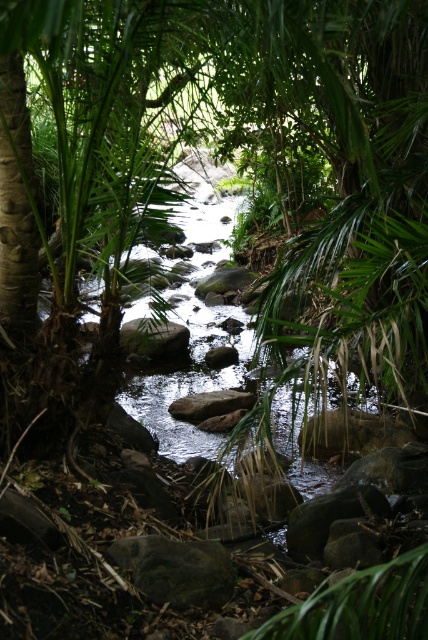
You are a hiker carrying a backpack weighing 20 pounds. You need to cross the stream shown in the image. The dark gray rock at center and the gray smooth rock at center are the only stable stepping stones available. Can you safely cross using these rocks without getting your backpack wet?

The dark gray rock at center and the gray smooth rock at center are 13.22 feet apart from each other. Since the distance between them is too large for a hiker to safely jump across while carrying a 20 pound backpack, it would not be advisable to attempt crossing using these rocks.

In the scene shown: You are a hiker trying to cross the stream using the rocks. You have a backpack that is 30 cm wide. Which rock, the dark gray rock at center or the gray smooth rock at center, can your backpack fit on without falling off?

The gray smooth rock at center is wider than the dark gray rock at center, so the backpack can fit on the gray smooth rock at center since it is wider than 30 cm. The dark gray rock at center is thinner and may not provide enough space.

Looking at this image, you are standing at the edge of the stream in the tropical scene. There is a point marked at coordinates (177, 570). Which object from the scene is this point located on?

The point at coordinates (177, 570) is located on the dark gray rock at center.